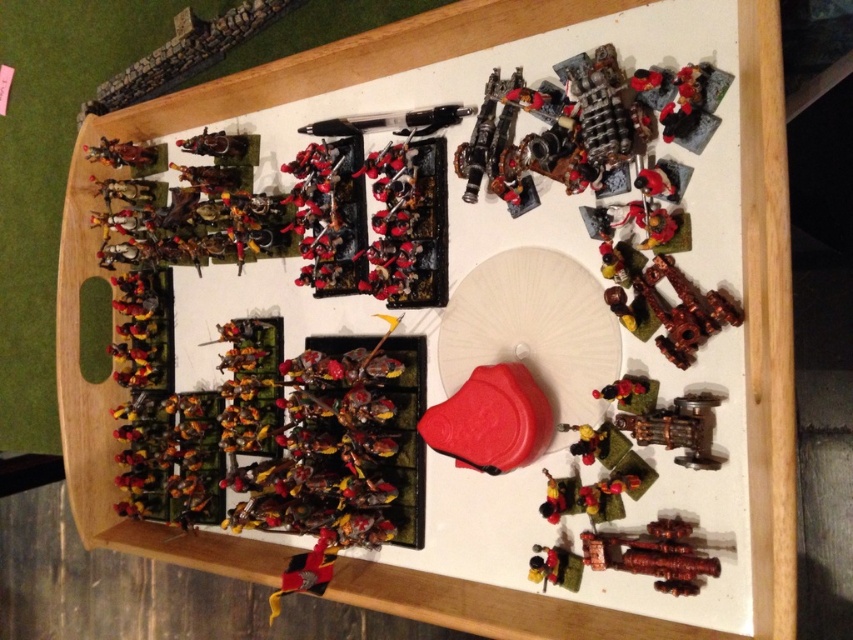
Question: Is white paper plate at center positioned in front of shiny gold armor at upper left?

Choices:
 (A) no
 (B) yes

Answer: (B)

Question: Can you confirm if white paper plate at center is smaller than shiny gold armor at upper left?

Choices:
 (A) yes
 (B) no

Answer: (B)

Question: Is white paper plate at center to the right of shiny gold armor at upper left from the viewer's perspective?

Choices:
 (A) no
 (B) yes

Answer: (B)

Question: Among these points, which one is farthest from the camera?

Choices:
 (A) (119, 140)
 (B) (502, 257)

Answer: (A)